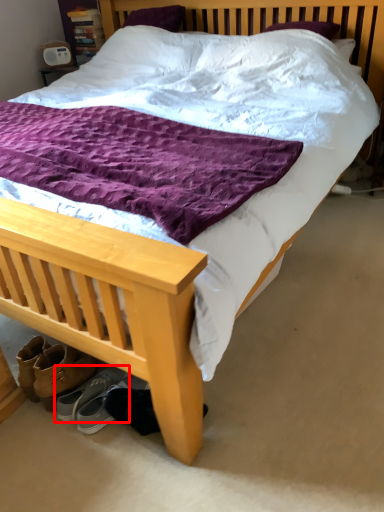
Question: In this image, where is footwear (annotated by the red box) located relative to footwear?

Choices:
 (A) right
 (B) left

Answer: (B)